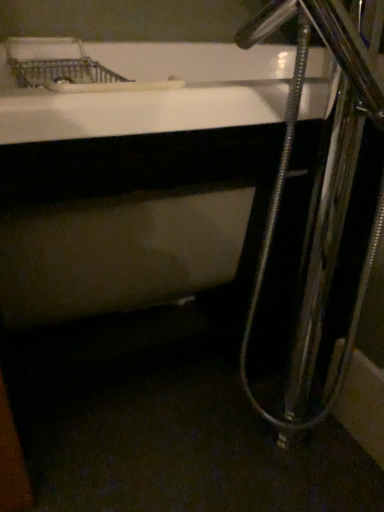
Describe the element at coordinates (326, 197) in the screenshot. I see `satin nickel faucet at right` at that location.

I want to click on satin nickel faucet at right, so click(326, 197).

I want to click on satin nickel faucet at right, so click(326, 197).